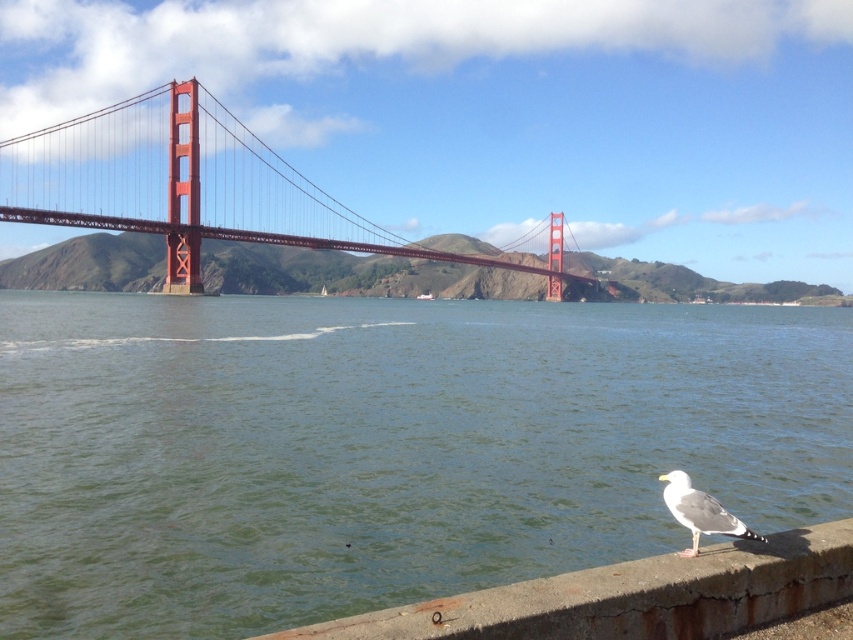
You are a photographer planning to capture the Golden Gate Bridge from this viewpoint. You want to ensure that both the green water at lower center and the concrete at lower right are visible in your shot. Given their sizes, which object will occupy more of the frame?

The green water at lower center will occupy more of the frame since it has a larger size compared to the concrete at lower right.

You are standing at the edge of the Golden Gate Bridge and see the green water at lower center and the concrete at lower right. Which object is closer to your left side?

The green water at lower center is to the left of concrete at lower right, so the green water at lower center is closer to your left side.

You are standing at the Golden Gate Bridge and see two points marked on the scene. The first point is at coordinates point (283, 179) and the second is at point (724, 522). Which point is closer to you?

Point (283, 179) is closer to you because it is further to the viewer than point (724, 522).